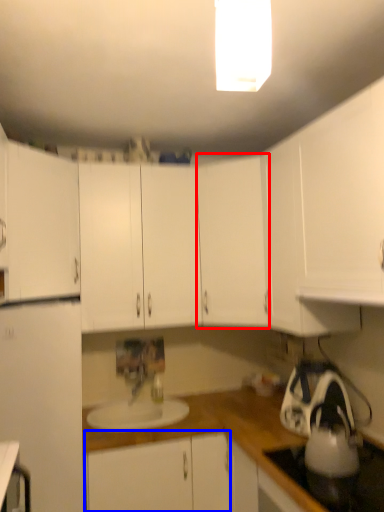
Question: Which of the following is the farthest to the observer, cabinetry (highlighted by a red box) or cabinetry (highlighted by a blue box)?

Choices:
 (A) cabinetry
 (B) cabinetry

Answer: (A)